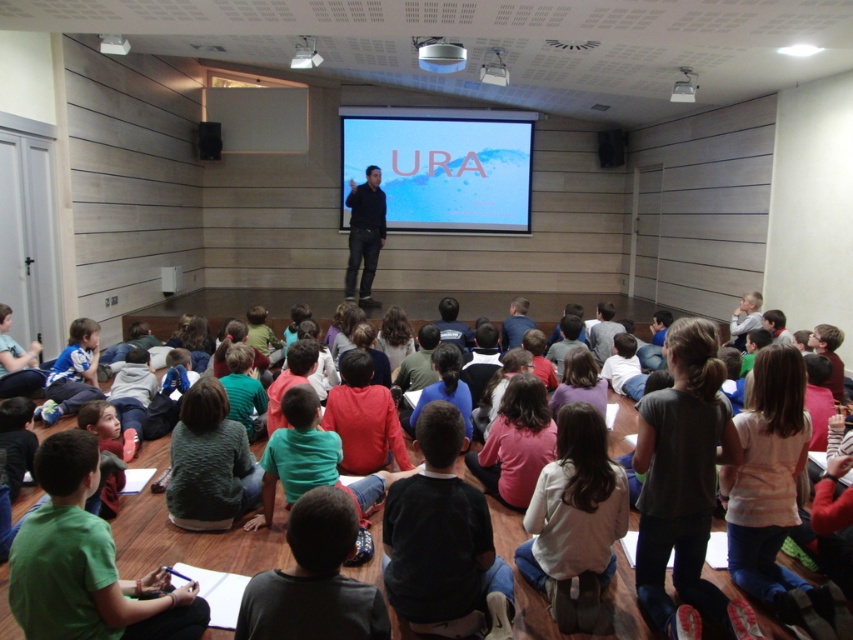
How distant is dark brown hair at lower center from dark blue jeans at center?

dark brown hair at lower center and dark blue jeans at center are 6.98 meters apart.

In order to click on dark brown hair at lower center in this screenshot , I will do `click(314, 580)`.

Who is higher up, white plastic projector at upper center or black matte speaker at upper center?

black matte speaker at upper center

How much distance is there between white plastic projector at upper center and black matte speaker at upper center?

The distance of white plastic projector at upper center from black matte speaker at upper center is 16.88 feet.

The height and width of the screenshot is (640, 853). I want to click on white plastic projector at upper center, so click(442, 58).

This screenshot has width=853, height=640. Find the location of `white plastic projector at upper center`. white plastic projector at upper center is located at coordinates (442, 58).

Does white matte shirt at center have a smaller size compared to black matte speaker at upper right?

No.

Between white matte shirt at center and black matte speaker at upper right, which one has more height?

white matte shirt at center is taller.

Find the location of `white matte shirt at center`. white matte shirt at center is located at coordinates (575, 518).